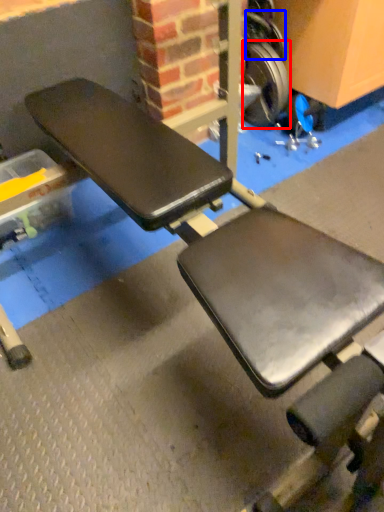
Question: Which of the following is the farthest to the observer, wheel (highlighted by a red box) or wheel (highlighted by a blue box)?

Choices:
 (A) wheel
 (B) wheel

Answer: (A)